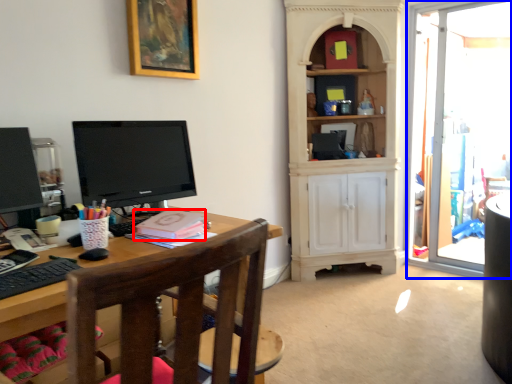
Question: Which point is further to the camera, book (highlighted by a red box) or glass door (highlighted by a blue box)?

Choices:
 (A) book
 (B) glass door

Answer: (B)